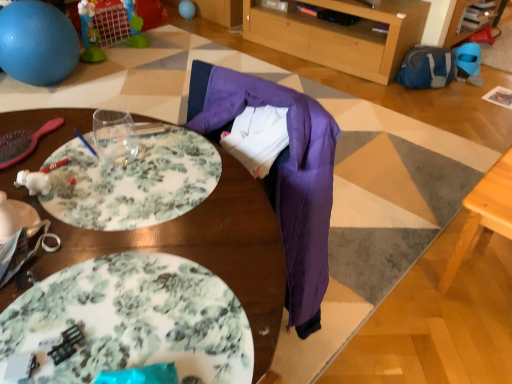
Question: Should I look upward or downward to see matte blue balloon at upper center?

Choices:
 (A) down
 (B) up

Answer: (B)

Question: Does wooden table at center, positioned as the 2th table in right-to-left order, appear on the right side of matte blue balloon at upper center?

Choices:
 (A) yes
 (B) no

Answer: (A)

Question: Can you see wooden table at center, positioned as the 2th table in right-to-left order, touching matte blue balloon at upper center?

Choices:
 (A) no
 (B) yes

Answer: (A)

Question: Does wooden table at center, positioned as the 2th table in right-to-left order, come in front of matte blue balloon at upper center?

Choices:
 (A) yes
 (B) no

Answer: (A)

Question: Considering the relative sizes of wooden table at center, which is counted as the first table, starting from the left, and matte blue balloon at upper center in the image provided, is wooden table at center, which is counted as the first table, starting from the left, thinner than matte blue balloon at upper center?

Choices:
 (A) yes
 (B) no

Answer: (B)

Question: Can you confirm if wooden table at center, positioned as the 2th table in right-to-left order, is smaller than matte blue balloon at upper center?

Choices:
 (A) yes
 (B) no

Answer: (B)

Question: From a real-world perspective, does wooden table at center, positioned as the 2th table in right-to-left order, sit lower than matte blue balloon at upper center?

Choices:
 (A) no
 (B) yes

Answer: (A)

Question: Is blue rubber ball at upper left surrounded by light wood table at lower right, the 1th table viewed from the right?

Choices:
 (A) yes
 (B) no

Answer: (B)

Question: From a real-world perspective, is light wood table at lower right, marked as the 2th table in a left-to-right arrangement, on top of blue rubber ball at upper left?

Choices:
 (A) no
 (B) yes

Answer: (A)

Question: Does light wood table at lower right, the 1th table viewed from the right, come in front of blue rubber ball at upper left?

Choices:
 (A) no
 (B) yes

Answer: (B)

Question: Is light wood table at lower right, the 1th table viewed from the right, shorter than blue rubber ball at upper left?

Choices:
 (A) no
 (B) yes

Answer: (B)

Question: Is light wood table at lower right, the 1th table viewed from the right, beside blue rubber ball at upper left?

Choices:
 (A) no
 (B) yes

Answer: (A)

Question: Would you say light wood table at lower right, the 1th table viewed from the right, is outside blue rubber ball at upper left?

Choices:
 (A) no
 (B) yes

Answer: (B)

Question: Is blue rubber ball at upper left directly adjacent to white glossy plate at lower left, placed as the 1th plate when sorted from left to right?

Choices:
 (A) no
 (B) yes

Answer: (A)